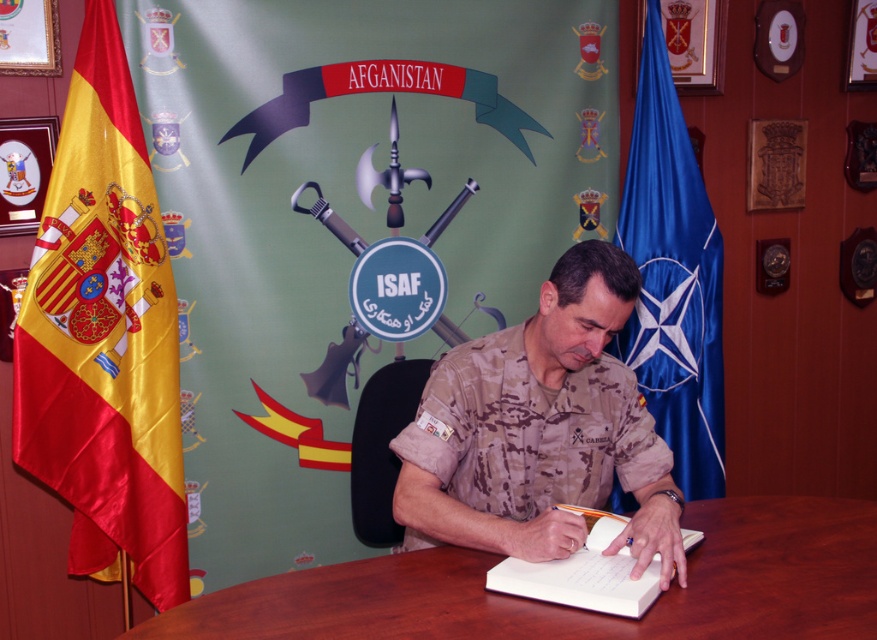
Question: Does camouflage uniform at center appear over brown wooden table at center?

Choices:
 (A) yes
 (B) no

Answer: (A)

Question: Considering the real-world distances, which object is closest to the blue satin flag at right?

Choices:
 (A) yellow satin flag at left
 (B) white paper notebook at center
 (C) brown wooden table at center
 (D) camouflage uniform at center

Answer: (C)

Question: Can you confirm if yellow satin flag at left is positioned to the left of white paper notebook at center?

Choices:
 (A) no
 (B) yes

Answer: (B)

Question: Which object is the closest to the white paper notebook at center?

Choices:
 (A) camouflage uniform at center
 (B) yellow satin flag at left
 (C) blue satin flag at right
 (D) brown wooden table at center

Answer: (D)

Question: Does yellow satin flag at left appear on the left side of camouflage uniform at center?

Choices:
 (A) yes
 (B) no

Answer: (A)

Question: Which object appears farthest from the camera in this image?

Choices:
 (A) yellow satin flag at left
 (B) brown wooden table at center
 (C) blue satin flag at right

Answer: (C)